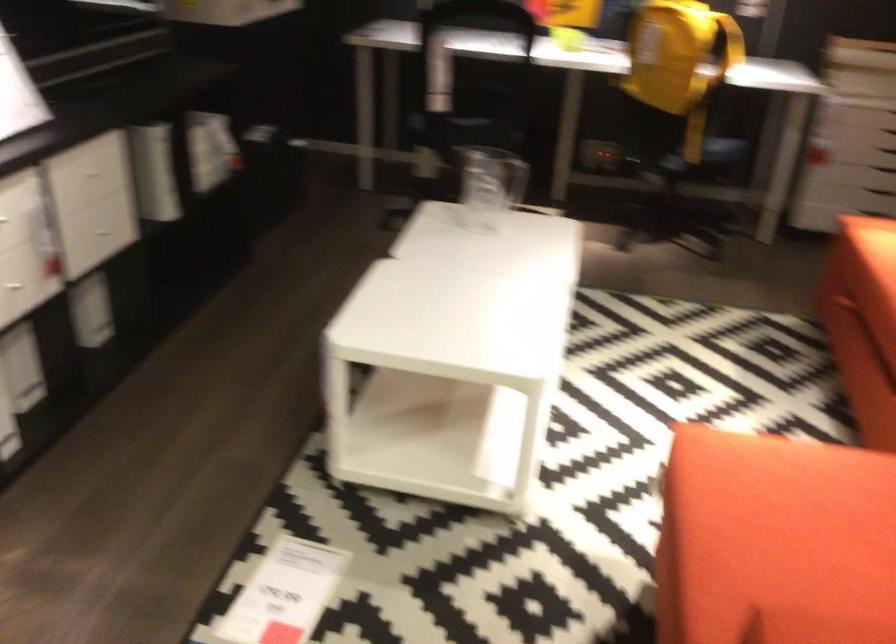
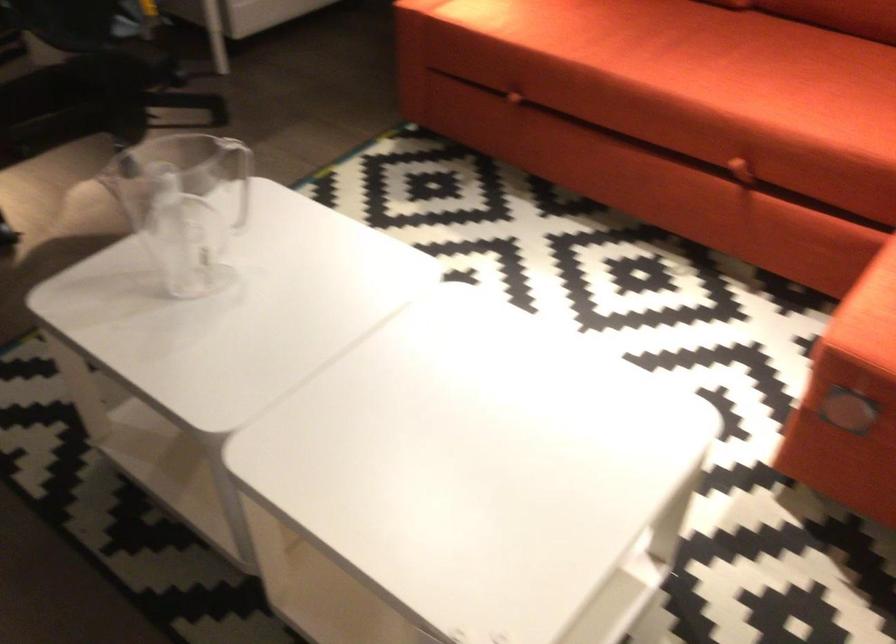
Locate, in the second image, the point that corresponds to [678,270] in the first image.

(238, 176)